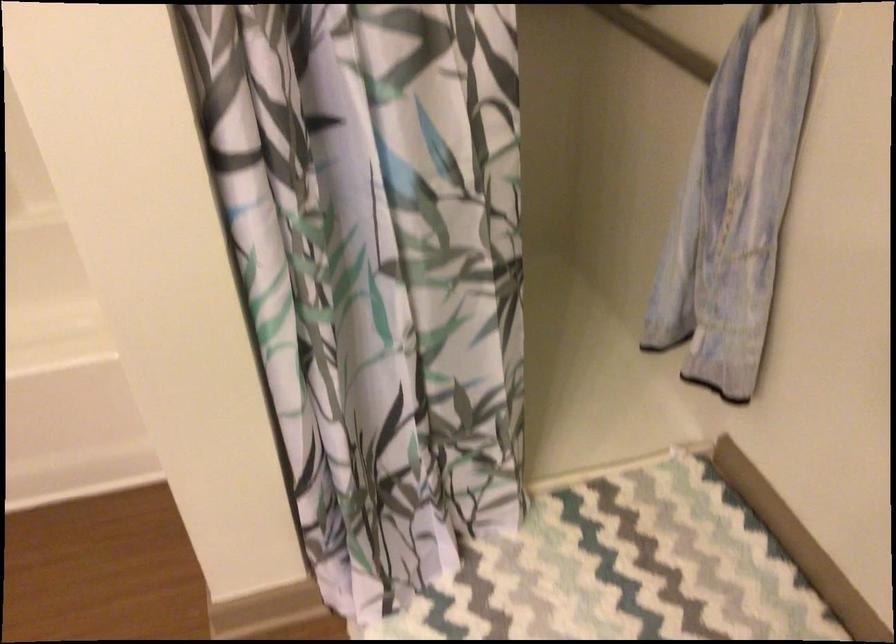
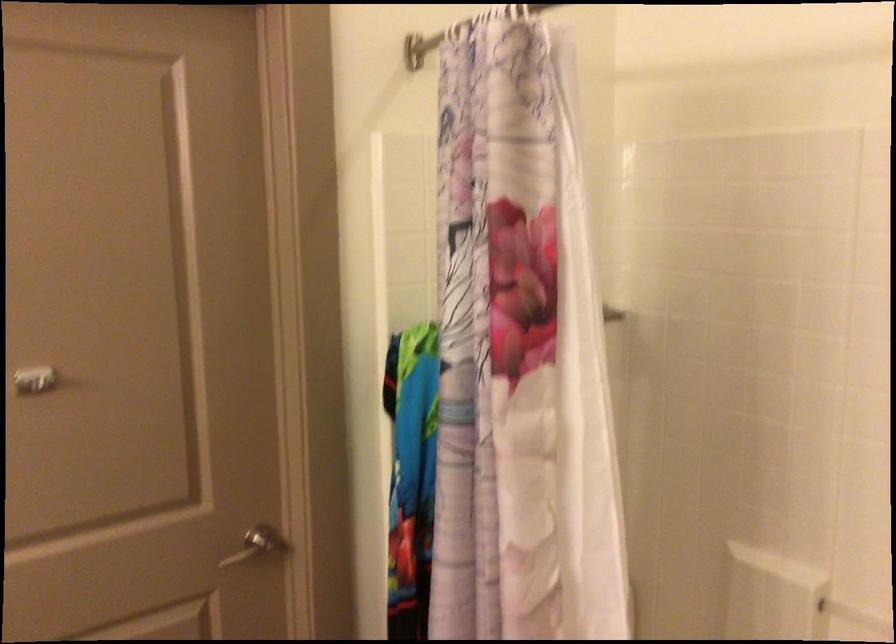
Question: The first image is from the beginning of the video and the second image is from the end. How did the camera likely rotate when shooting the video?

Choices:
 (A) Left
 (B) Right
 (C) Up
 (D) Down

Answer: (A)